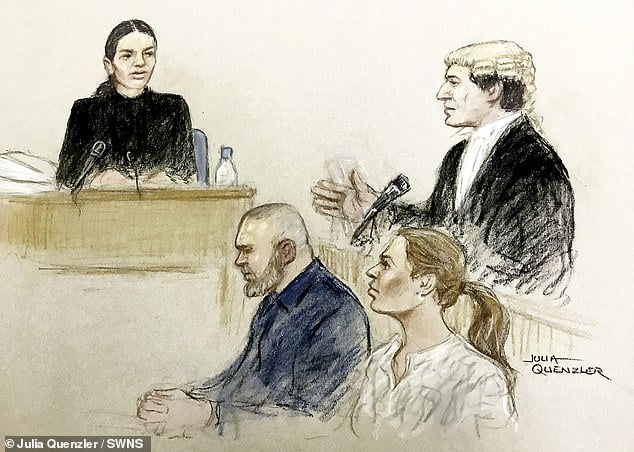
Locate an element on the screen. This screenshot has width=634, height=452. courtroom scene is located at coordinates (120, 316), (143, 149), (295, 119), (468, 389), (257, 383).